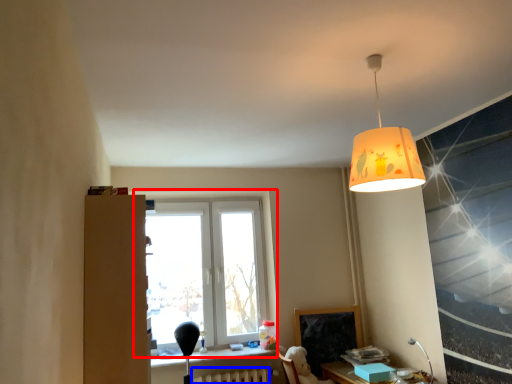
Question: Among these objects, which one is farthest to the camera, window (highlighted by a red box) or radiator (highlighted by a blue box)?

Choices:
 (A) window
 (B) radiator

Answer: (A)